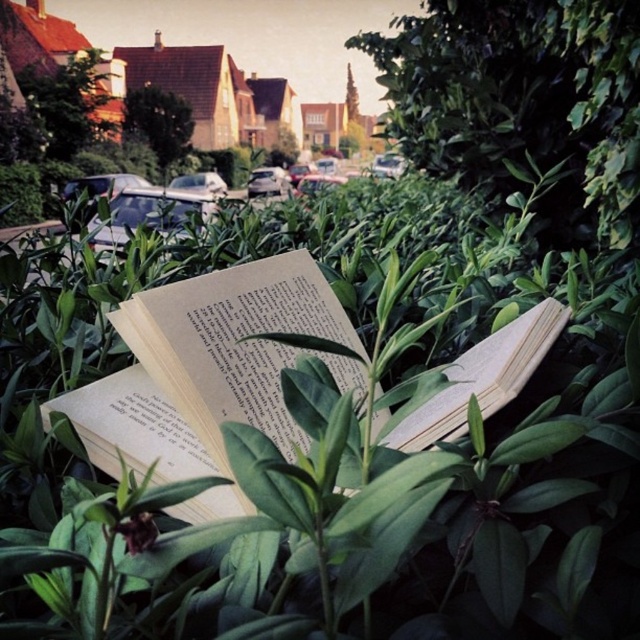
You are a delivery person who needs to place a package between the beige paper book at center and the metallic silver car at center. The package requires a minimum of 5 feet of space to be safely placed. Based on the scene, can you safely place the package there?

The beige paper book at center is 4.66 feet from the metallic silver car at center. Since the required space is 5 feet, the distance is insufficient, so the package cannot be safely placed there.

You have a beige paper book at center and a silver metallic car at center in the scene. Which object is wider?

The silver metallic car at center is wider than the beige paper book at center.

You are a delivery person trying to park your car in a tight space between the metallic silver car at center and the silver metallic car at center. Can you fit your car there if your car is 1.8 meters wide?

The metallic silver car at center is positioned on the left side of silver metallic car at center, but there is no information provided about the distance between them. Without knowing the space between the two cars, it is impossible to determine if your car can fit.